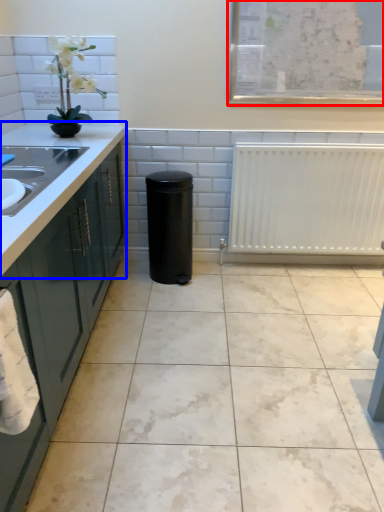
Question: Among these objects, which one is nearest to the camera, window screen (highlighted by a red box) or countertop (highlighted by a blue box)?

Choices:
 (A) window screen
 (B) countertop

Answer: (B)